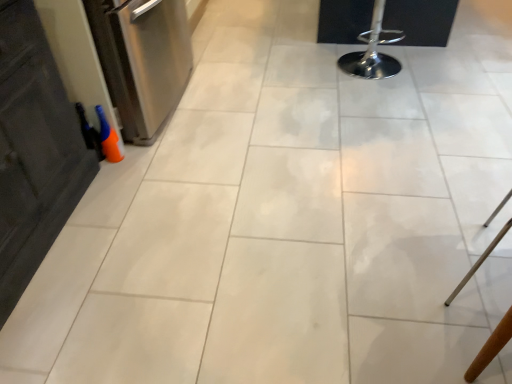
Find the location of a particular element. The height and width of the screenshot is (384, 512). free space between stainless steel dishwasher at left and wooden chair at lower right is located at coordinates (318, 178).